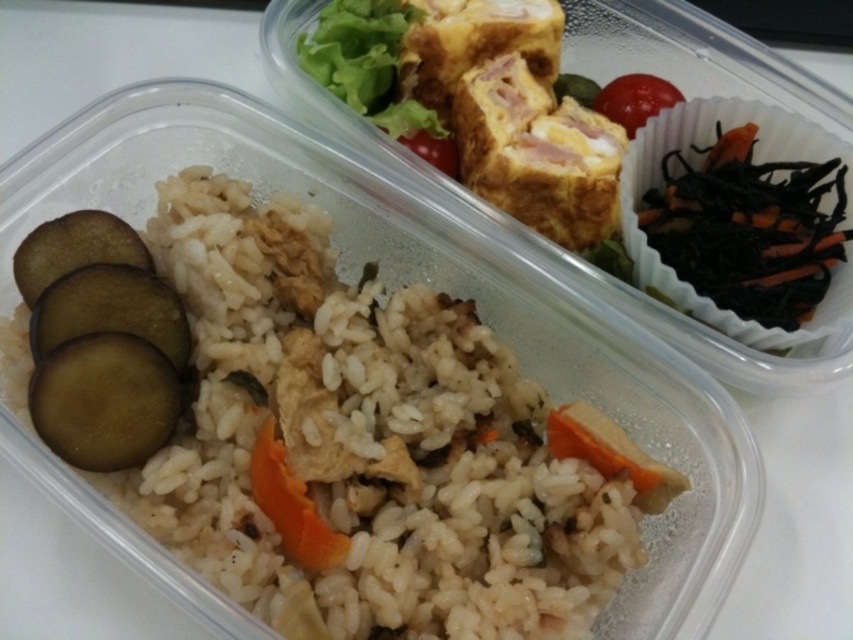
You are packing a lunchbox and have both the black shredded seaweed at upper right and the orange matte carrot at center. Which one takes up more space in your container?

The black shredded seaweed at upper right is bigger than the orange matte carrot at center, so it takes up more space in the container.

You are preparing to take a photo of the white matte rice at center and the black shredded seaweed at upper right for a food blog. To ensure both elements are visible in the frame, where should you position your camera relative to the containers?

Position your camera above the containers so that you can see both the white matte rice at center and the black shredded seaweed at upper right, since the white matte rice at center is positioned under the black shredded seaweed at upper right.

You are packing a lunchbox and want to ensure the white matte rice at center and the black shredded seaweed at upper right fit properly. Given their sizes, which one requires more space in the container?

The white matte rice at center requires more space in the container because it has a larger size compared to the black shredded seaweed at upper right.